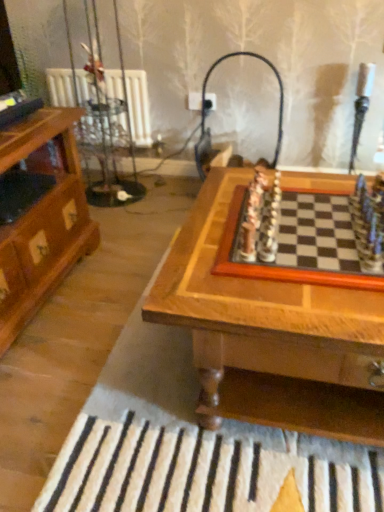
Find the location of a particular element. vacant space situated on the left part of wooden chessboard at center is located at coordinates (77, 332).